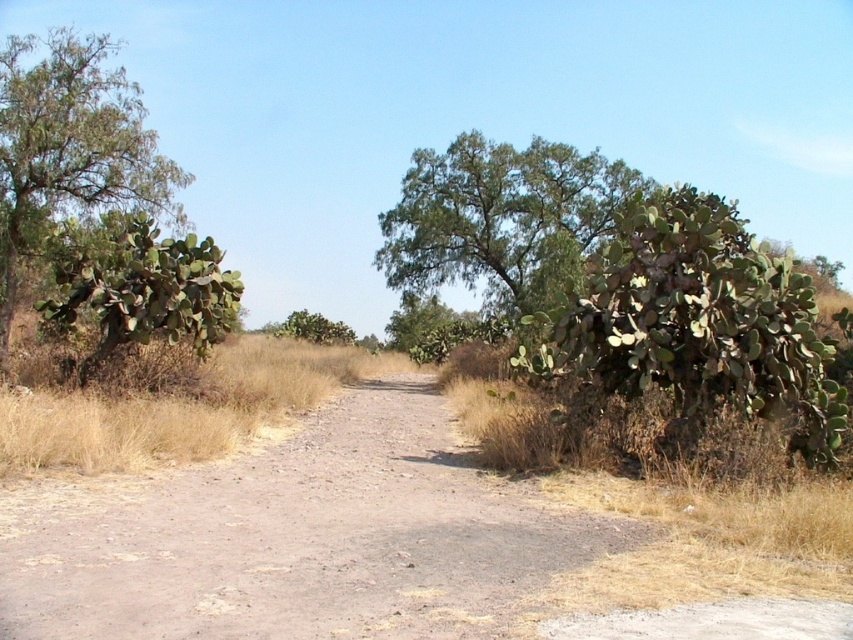
Question: Is the position of green spiny cactus at right more distant than that of green leafy tree at center?

Choices:
 (A) yes
 (B) no

Answer: (B)

Question: Which object is positioned closest to the dirt road at center?

Choices:
 (A) green spiny cactus at left
 (B) green leafy tree at left
 (C) green spiny cactus at right

Answer: (C)

Question: Does dirt road at center appear over green leafy tree at center?

Choices:
 (A) no
 (B) yes

Answer: (A)

Question: Can you confirm if green spiny cactus at right is positioned to the right of green leafy tree at left?

Choices:
 (A) yes
 (B) no

Answer: (A)

Question: Among these objects, which one is nearest to the camera?

Choices:
 (A) green spiny cactus at right
 (B) green spiny cactus at left

Answer: (A)

Question: Which of these objects is positioned closest to the dirt road at center?

Choices:
 (A) green spiny cactus at left
 (B) green spiny cactus at right
 (C) green leafy tree at left
 (D) green leafy tree at center

Answer: (B)